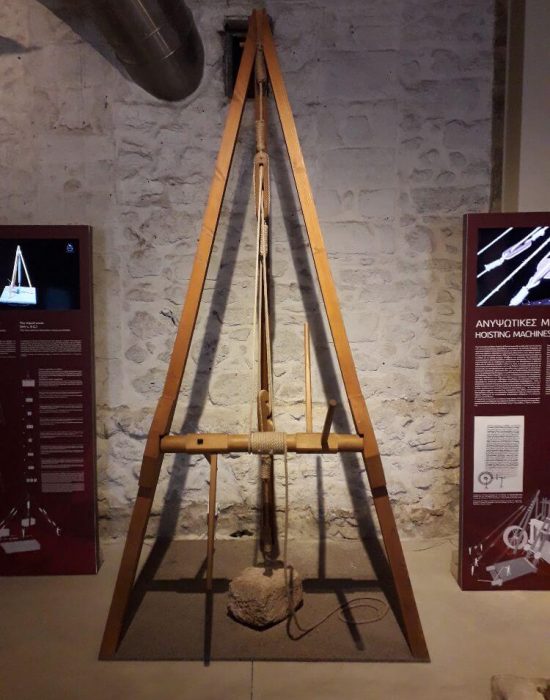
What are the coordinates of `floor` in the screenshot? It's located at (459, 642).